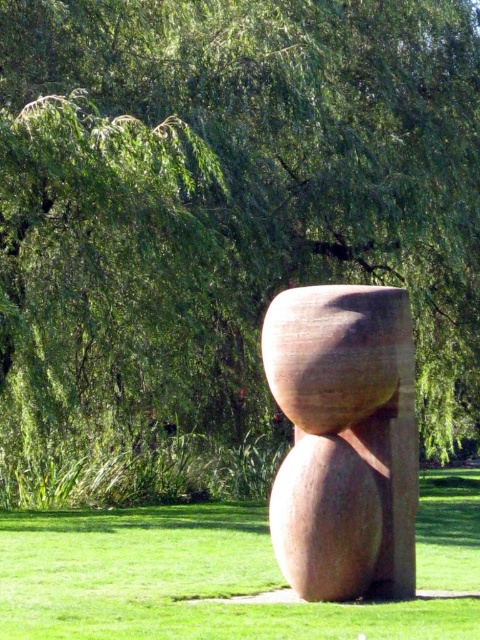
Question: Is green grass at lower center positioned at the back of matte brown stone sculpture at center?

Choices:
 (A) yes
 (B) no

Answer: (B)

Question: From the image, what is the correct spatial relationship of green grass at lower center in relation to matte brown stone sculpture at center?

Choices:
 (A) below
 (B) above

Answer: (A)

Question: Which of the following is the farthest from the observer?

Choices:
 (A) (44, 550)
 (B) (295, 323)

Answer: (A)

Question: Is green grass at lower center thinner than matte brown stone sculpture at center?

Choices:
 (A) yes
 (B) no

Answer: (B)